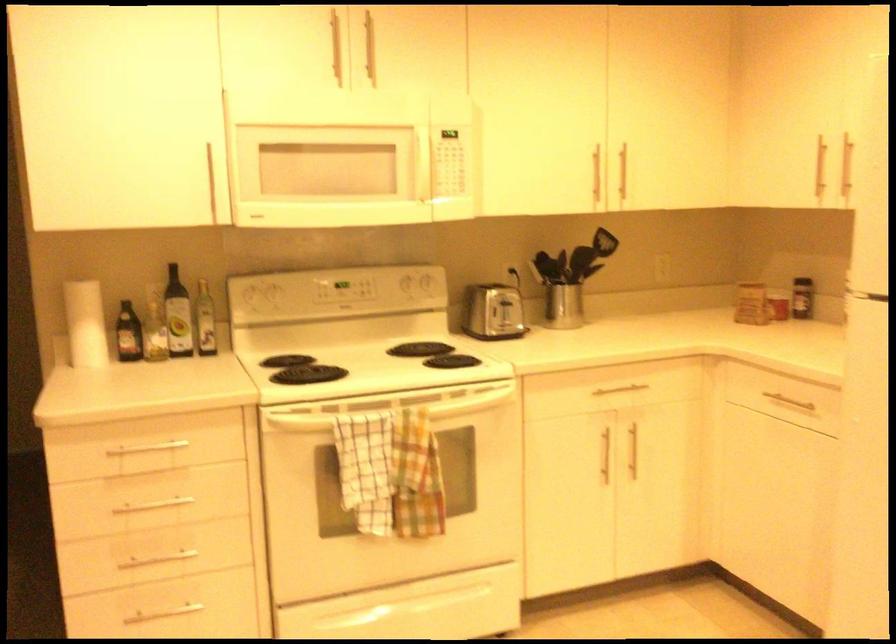
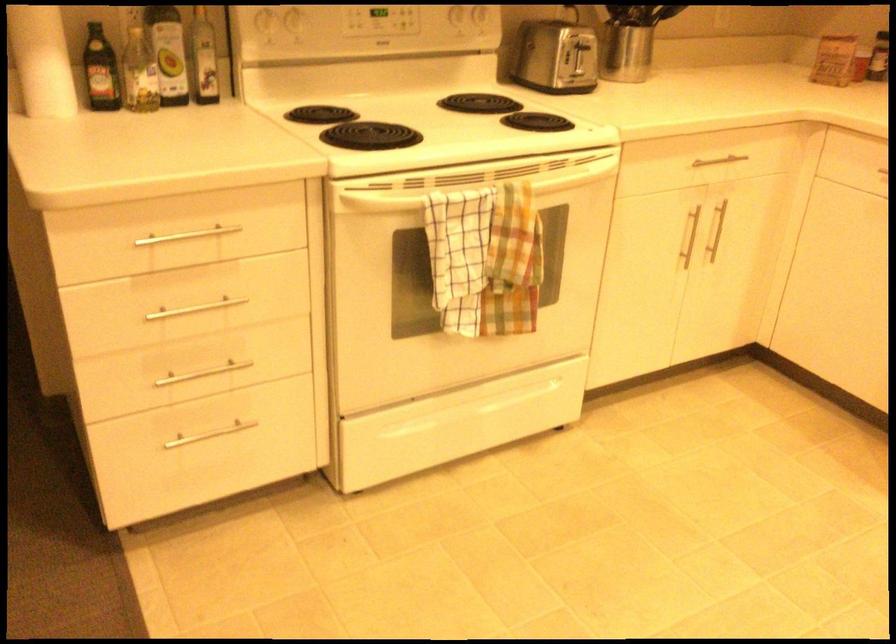
The point at [149,339] is marked in the first image. Where is the corresponding point in the second image?

(140, 73)